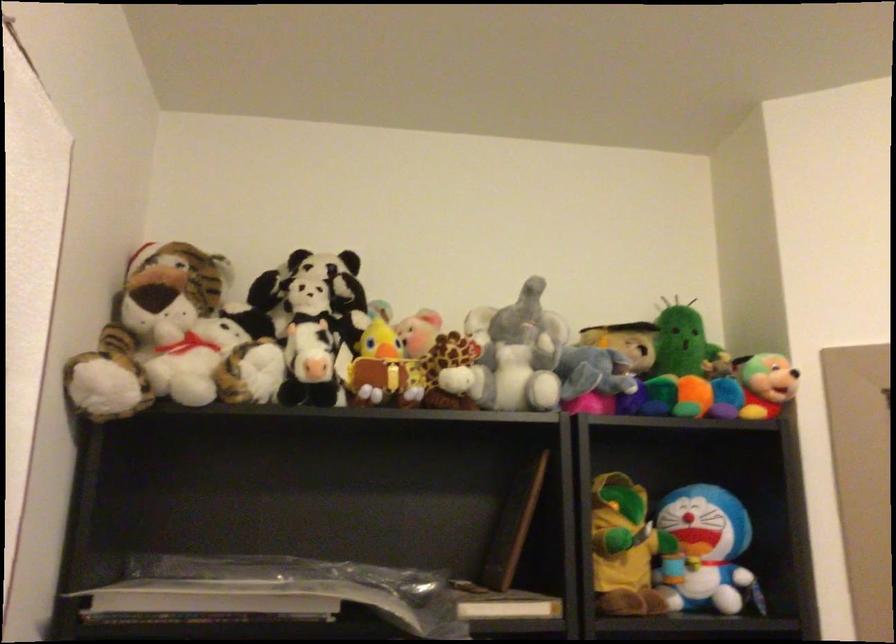
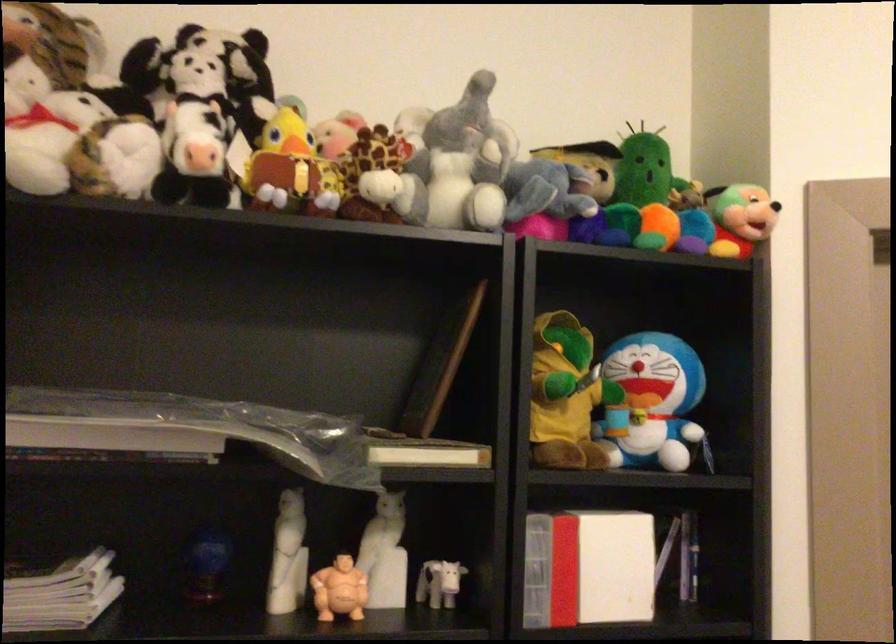
In the second image, find the point that corresponds to point 406,368 in the first image.

(316, 169)